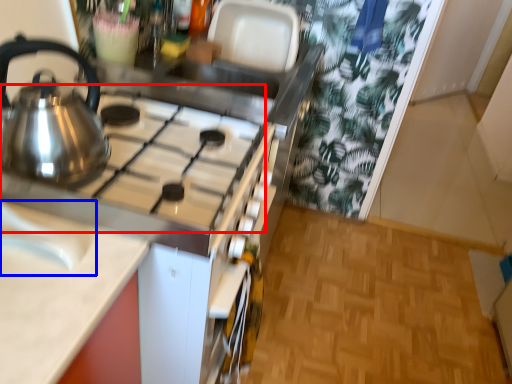
Question: Which object appears closest to the camera in this image, gas stove (highlighted by a red box) or sink (highlighted by a blue box)?

Choices:
 (A) gas stove
 (B) sink

Answer: (B)